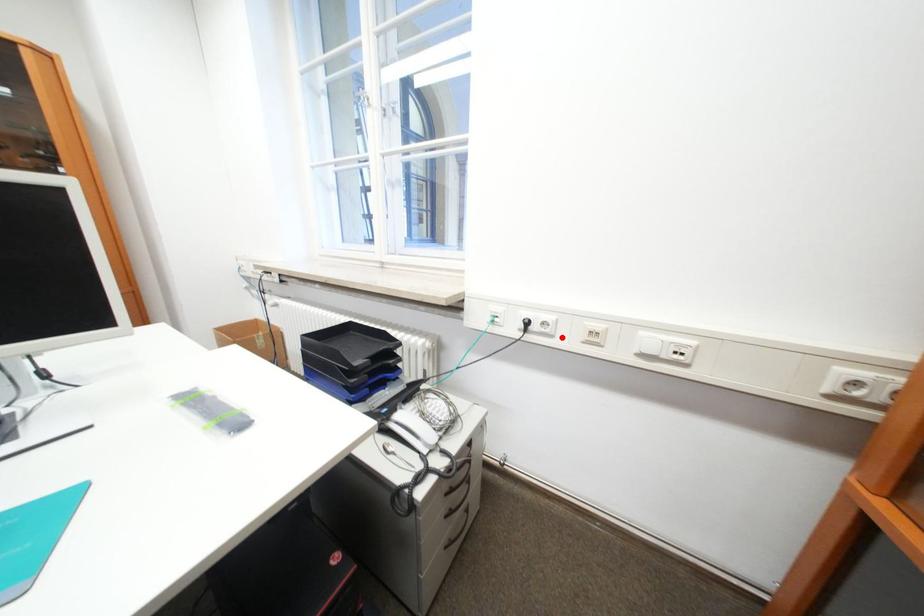
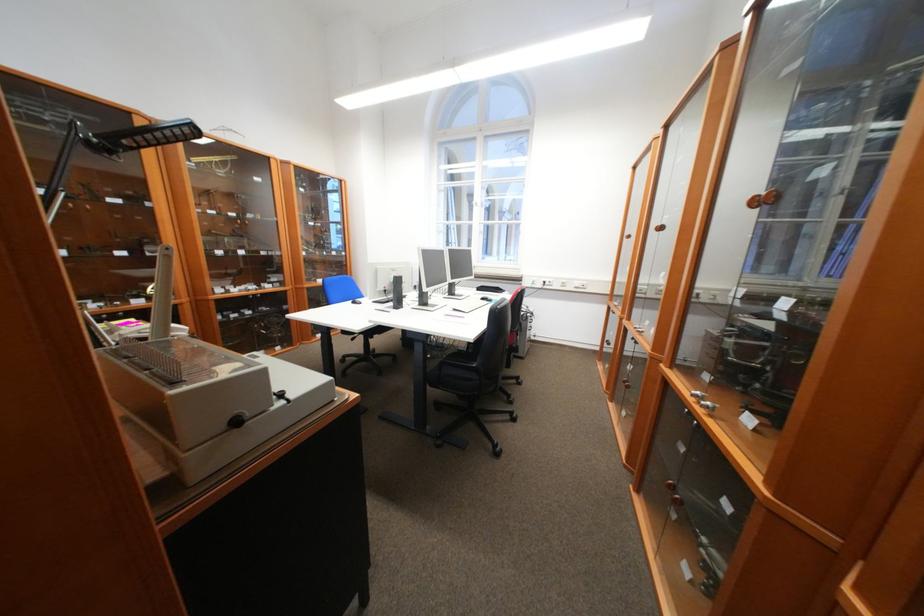
In the second image, find the point that corresponds to the highlighted location in the first image.

(562, 286)